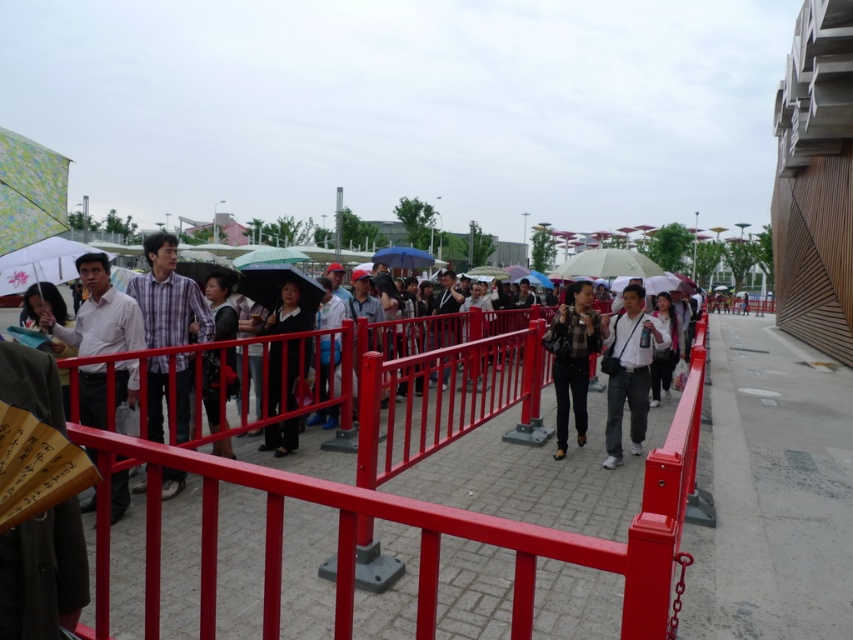
Question: Is plaid fabric shirt at center below plaid shirt at center?

Choices:
 (A) yes
 (B) no

Answer: (B)

Question: Estimate the real-world distances between objects in this image. Which object is farther from the metallic red fence at center?

Choices:
 (A) matte white shirt at left
 (B) black fabric jacket at center
 (C) black matte jacket at center
 (D) plaid shirt at center

Answer: (A)

Question: From the image, what is the correct spatial relationship of plaid fabric shirt at center in relation to white matte shirt at center?

Choices:
 (A) right
 (B) left

Answer: (B)

Question: Among these points, which one is farthest from the camera?

Choices:
 (A) (286, 550)
 (B) (225, 444)
 (C) (624, 330)
 (D) (148, 392)

Answer: (C)

Question: Where is metallic red fence at center located in relation to plaid fabric shirt at center in the image?

Choices:
 (A) below
 (B) above

Answer: (A)

Question: Among these objects, which one is farthest from the camera?

Choices:
 (A) white matte shirt at center
 (B) metallic red fence at center

Answer: (B)